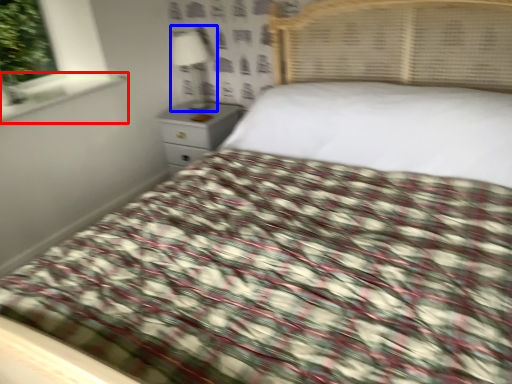
Question: Which point is further to the camera, window sill (highlighted by a red box) or lamp (highlighted by a blue box)?

Choices:
 (A) window sill
 (B) lamp

Answer: (B)